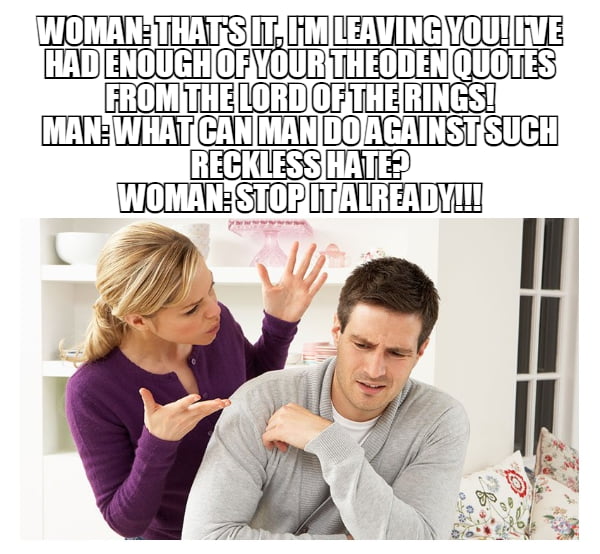
Locate an element on the screen. three pillows is located at coordinates point(505,511), point(557,512), point(561,464).